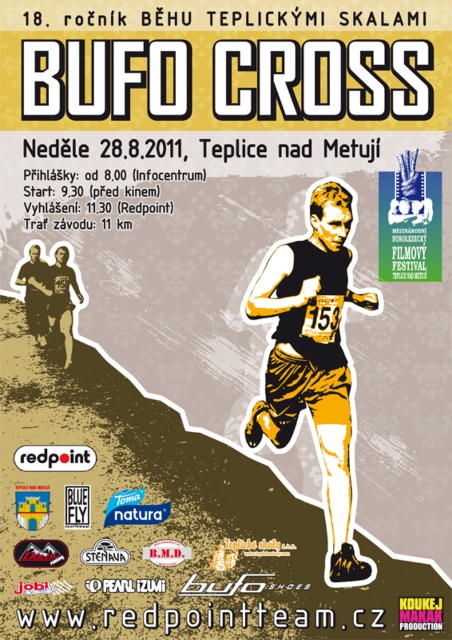
You are a participant in the BUFO CROSS event and need to choose between the yellow textured shorts at lower left and the matte black running suit at lower left for your outfit. Which item has a greater width?

The yellow textured shorts at lower left has a greater width than the matte black running suit at lower left.

You are a photographer standing at the camera position in the poster. You want to capture a photo of the yellow textured shorts at center. Given that your camera has a minimum focusing distance of 10 meters, will you be able to take a clear photo of the shorts?

The yellow textured shorts at center and camera are 8.92 meters apart from each other. Since the minimum focusing distance is 10 meters, the camera cannot focus clearly at 8.92 meters. You need to move back or use a different camera with a shorter minimum focusing distance.